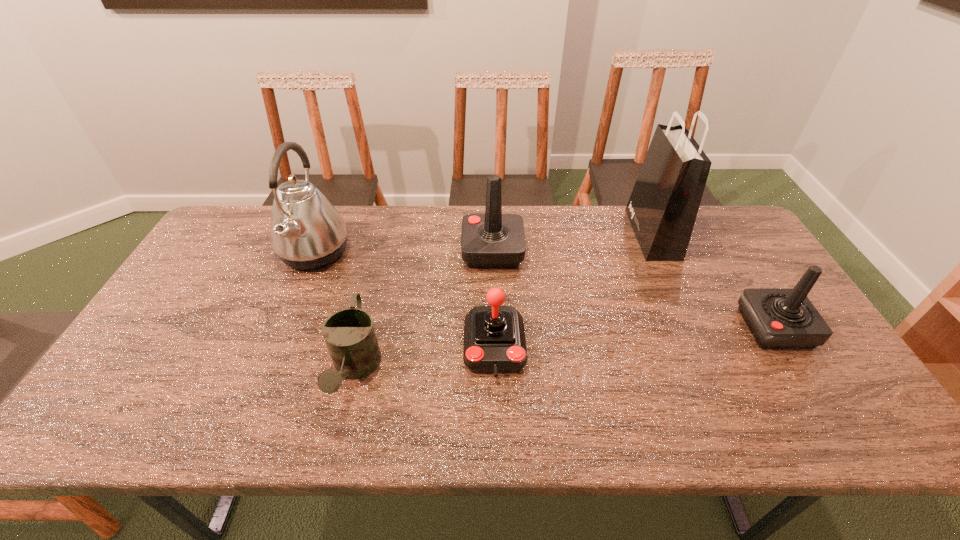
Locate an element on the screen. unoccupied position between the shortest joystick and the fifth object from right to left is located at coordinates (425, 359).

Identify the location of free space between the second object from right to left and the watering can. (504, 302).

Where is `blank region between the rightmost object and the leftmost object`? Image resolution: width=960 pixels, height=540 pixels. blank region between the rightmost object and the leftmost object is located at coordinates (544, 290).

The image size is (960, 540). I want to click on free space between the second object from left to right and the second object from right to left, so click(504, 302).

Image resolution: width=960 pixels, height=540 pixels. Identify the location of vacant space that is in between the farthest joystick and the shopping bag. (572, 243).

Select which object is the closest to the leftmost object. Please provide its 2D coordinates. Your answer should be formatted as a tuple, i.e. [(x, y)], where the tuple contains the x and y coordinates of a point satisfying the conditions above.

[(349, 334)]

Select which object appears as the closest to the fifth object from right to left. Please provide its 2D coordinates. Your answer should be formatted as a tuple, i.e. [(x, y)], where the tuple contains the x and y coordinates of a point satisfying the conditions above.

[(306, 231)]

Locate an element on the screen. The width and height of the screenshot is (960, 540). joystick that can be found as the second closest to the rightmost joystick is located at coordinates (494, 338).

Identify which joystick is the nearest to the rightmost object. Please provide its 2D coordinates. Your answer should be formatted as a tuple, i.e. [(x, y)], where the tuple contains the x and y coordinates of a point satisfying the conditions above.

[(493, 240)]

I want to click on vacant point that satisfies the following two spatial constraints: 1. on the front-facing side of the rightmost joystick; 2. with the spout on the second object from left to right, so click(x=801, y=370).